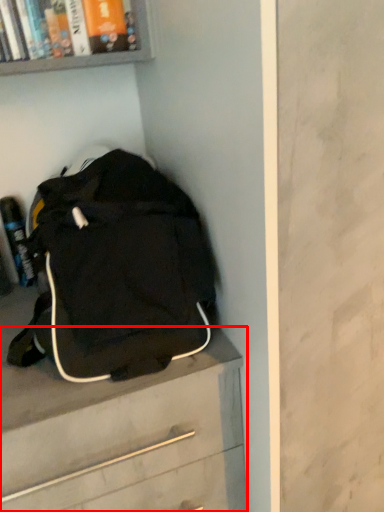
Question: From the image's perspective, where is chest of drawers (annotated by the red box) located in relation to backpack in the image?

Choices:
 (A) above
 (B) below

Answer: (B)